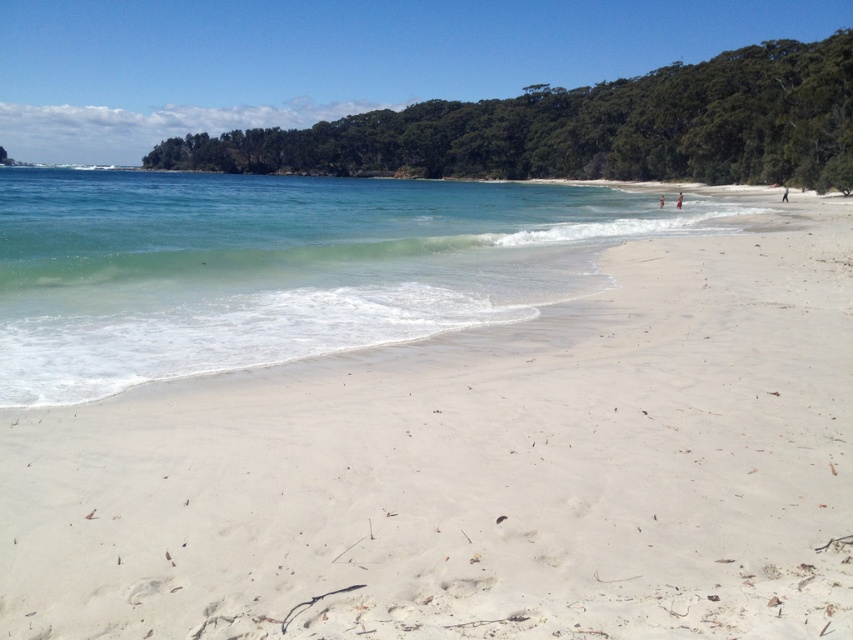
Is white sandy beach at center wider than clear water at lower left?

No.

Does white sandy beach at center appear under clear water at lower left?

Yes.

Which is in front, point (515, 480) or point (630, 220)?

Point (515, 480) is in front.

You are a GUI agent. You are given a task and a screenshot of the screen. Output one action in this format:
    pyautogui.click(x=<x>, y=<y>)
    Task: Click on the white sandy beach at center
    The width and height of the screenshot is (853, 640).
    Given the screenshot: What is the action you would take?
    pyautogui.click(x=477, y=470)